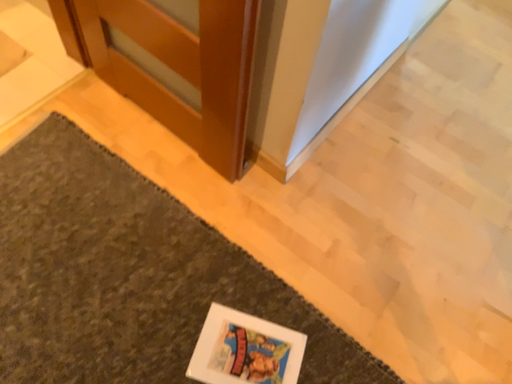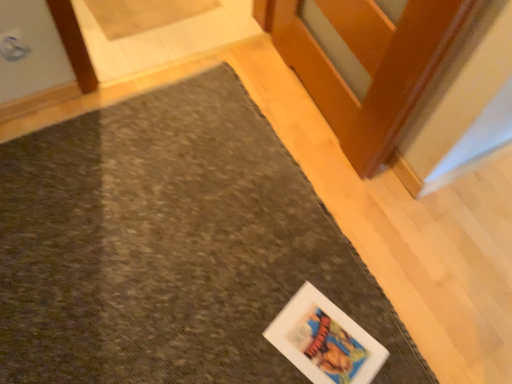
Question: How did the camera likely rotate when shooting the video?

Choices:
 (A) rotated left
 (B) rotated right

Answer: (A)